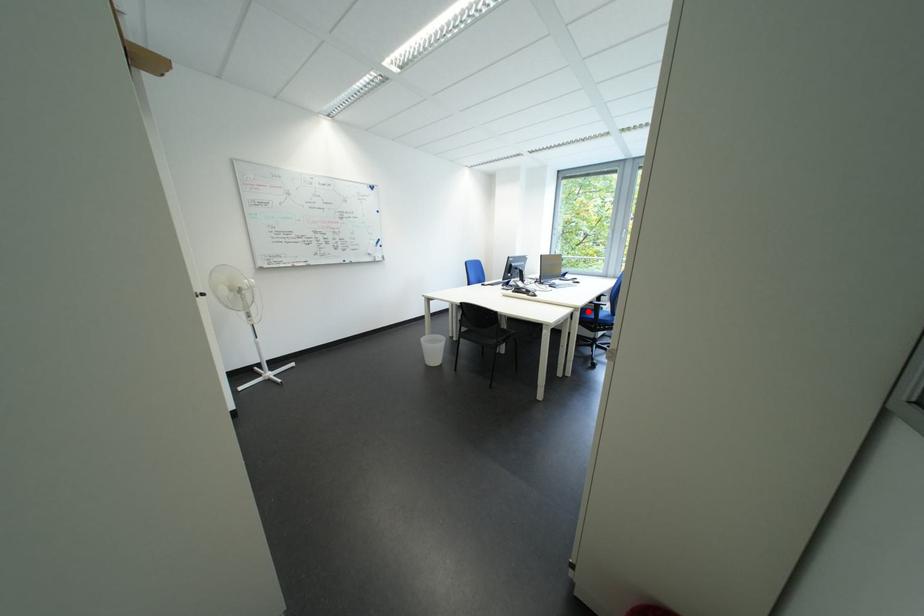
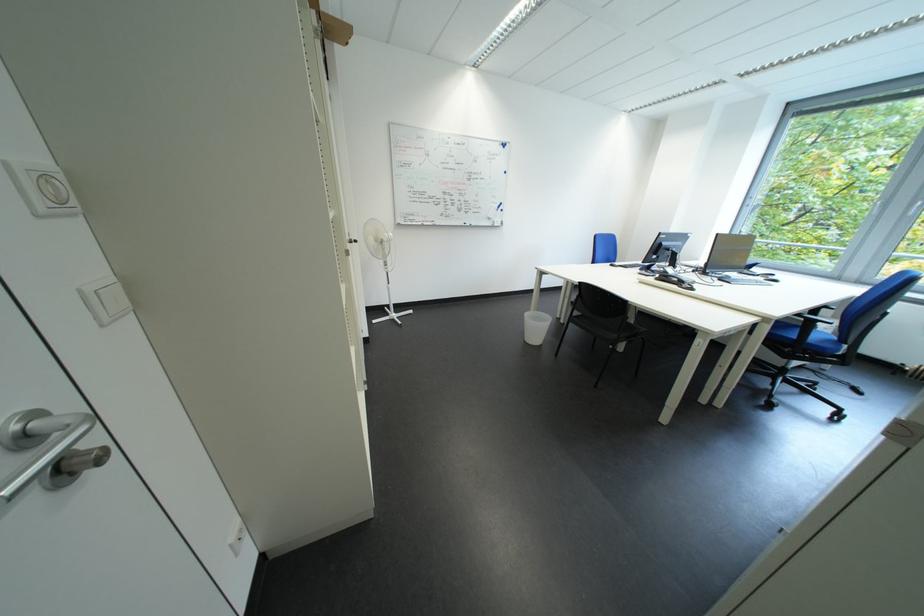
Locate, in the second image, the point that corresponds to the highlighted location in the first image.

(777, 322)